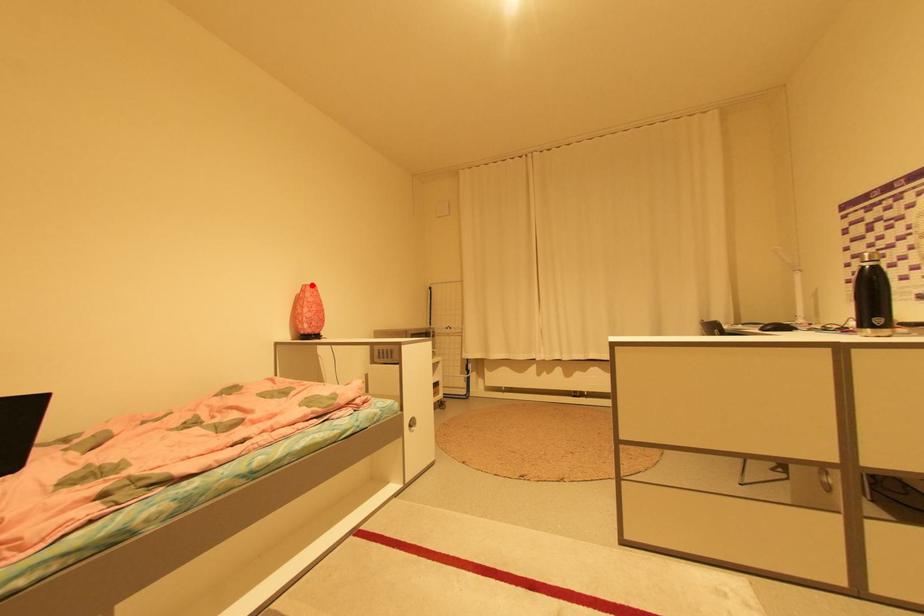
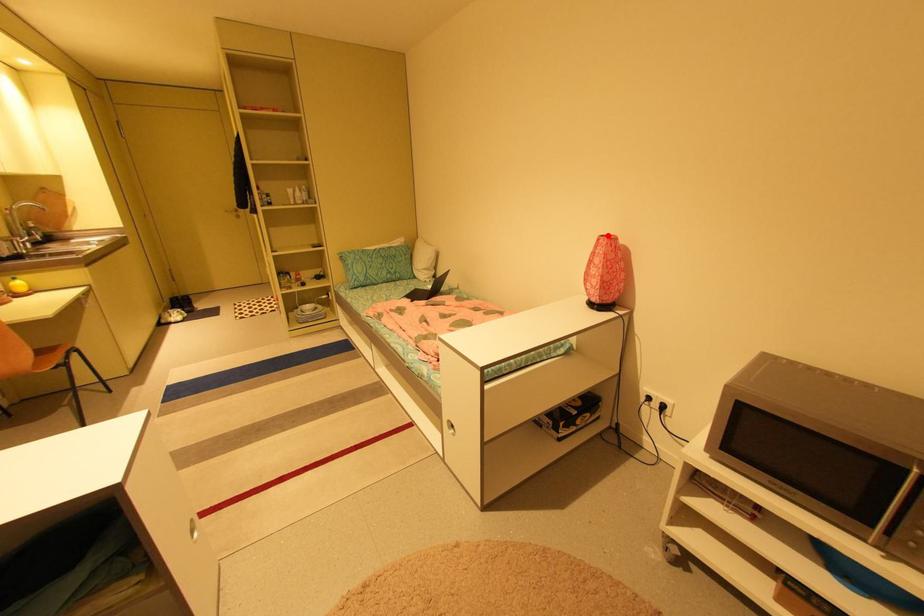
I am providing you with two images of the same scene from different viewpoints. A red point is marked on the first image and another point is marked on the second image. Are the points marked in image1 and image2 representing the same 3D position?

Yes